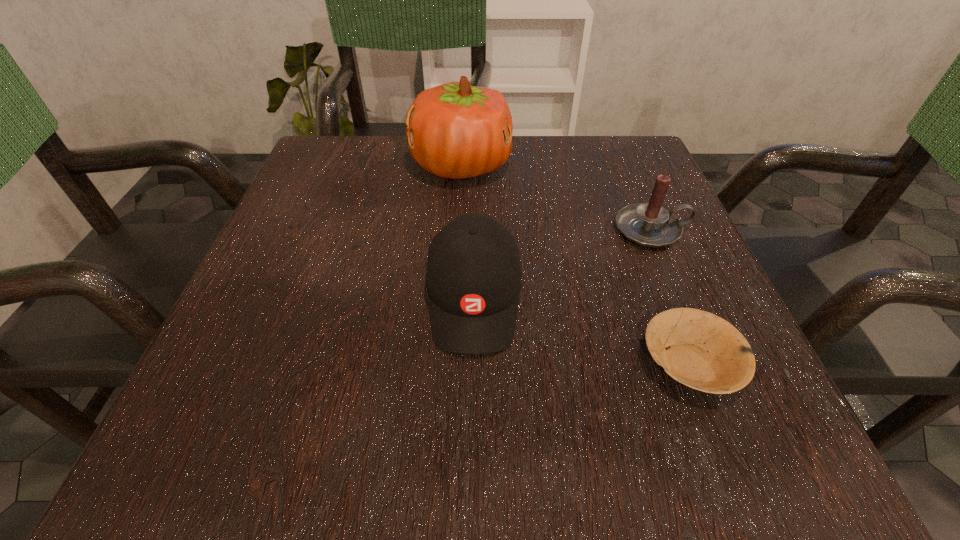
You are a GUI agent. You are given a task and a screenshot of the screen. Output one action in this format:
    pyautogui.click(x=<x>, y=<y>)
    Task: Click on the vacant space at the near right corner of the desktop
    This screenshot has width=960, height=540.
    Given the screenshot: What is the action you would take?
    pyautogui.click(x=689, y=471)

Where is `empty space that is in between the baseball cap and the bowl`? empty space that is in between the baseball cap and the bowl is located at coordinates (582, 331).

This screenshot has height=540, width=960. I want to click on free space between the tallest object and the candle, so click(x=556, y=198).

This screenshot has height=540, width=960. In order to click on free space between the bowl and the tallest object in this screenshot , I will do `click(575, 265)`.

You are a GUI agent. You are given a task and a screenshot of the screen. Output one action in this format:
    pyautogui.click(x=<x>, y=<y>)
    Task: Click on the free space between the baseball cap and the shortest object
    The image size is (960, 540).
    Given the screenshot: What is the action you would take?
    point(582,331)

Where is `free space between the candle and the shortest object`? free space between the candle and the shortest object is located at coordinates (670, 297).

The height and width of the screenshot is (540, 960). Find the location of `free point between the bowl and the candle`. free point between the bowl and the candle is located at coordinates (670, 297).

Locate an element on the screen. This screenshot has width=960, height=540. vacant space that is in between the shortest object and the pumpkin is located at coordinates (575, 265).

This screenshot has width=960, height=540. What are the coordinates of `free spot between the baseball cap and the bowl` in the screenshot? It's located at [582, 331].

Where is `empty space that is in between the farthest object and the bowl`? empty space that is in between the farthest object and the bowl is located at coordinates (575, 265).